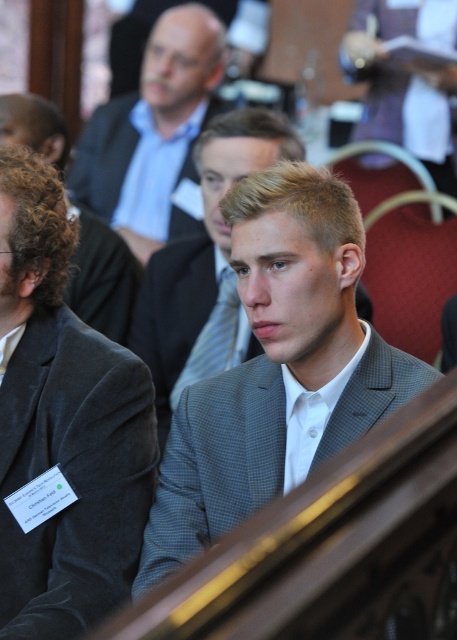
Is gray wool suit at center to the right of blue striped tie at center from the viewer's perspective?

Correct, you'll find gray wool suit at center to the right of blue striped tie at center.

Can you confirm if gray wool suit at center is wider than blue striped tie at center?

Yes.

Locate an element on the screen. gray wool suit at center is located at coordinates (405, 80).

Is point (133, 484) closer to camera compared to point (110, 124)?

Yes, it is.

Is dark gray suit at center wider than matte gray suit at center?

In fact, dark gray suit at center might be narrower than matte gray suit at center.

The width and height of the screenshot is (457, 640). In order to click on dark gray suit at center in this screenshot , I will do `click(63, 424)`.

Does matte gray suit at center have a larger size compared to gray textured suit at center?

Indeed, matte gray suit at center has a larger size compared to gray textured suit at center.

Looking at this image, does matte gray suit at center have a lesser width compared to gray textured suit at center?

In fact, matte gray suit at center might be wider than gray textured suit at center.

Find the location of `matte gray suit at center`. matte gray suit at center is located at coordinates (x=153, y=131).

The width and height of the screenshot is (457, 640). In order to click on matte gray suit at center in this screenshot , I will do `click(153, 131)`.